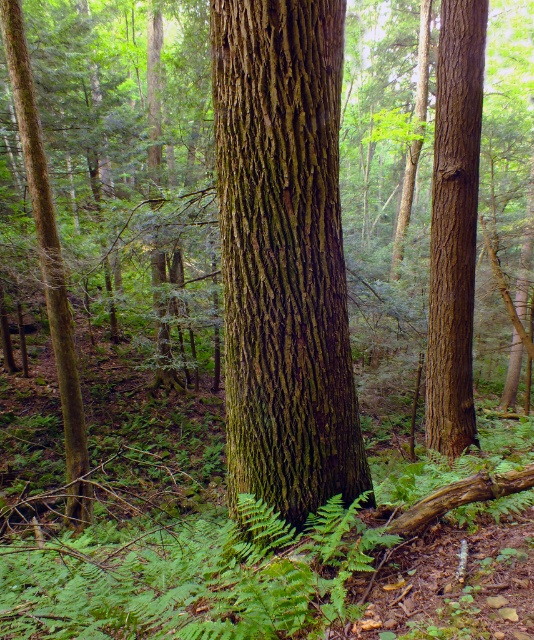
Question: Which object is positioned farthest from the smooth brown tree trunk at right?

Choices:
 (A) green rough bark tree trunk at center
 (B) green rough bark tree at left

Answer: (B)

Question: Which point is closer to the camera taking this photo?

Choices:
 (A) (6, 60)
 (B) (247, 141)
 (C) (449, 333)

Answer: (B)

Question: Is green rough bark tree trunk at center thinner than smooth brown tree trunk at right?

Choices:
 (A) yes
 (B) no

Answer: (B)

Question: Among these points, which one is nearest to the camera?

Choices:
 (A) (437, 129)
 (B) (310, 177)
 (C) (74, 388)

Answer: (B)

Question: Can you confirm if green rough bark tree trunk at center is positioned below smooth brown tree trunk at right?

Choices:
 (A) yes
 (B) no

Answer: (A)

Question: Can you confirm if green rough bark tree trunk at center is bigger than smooth brown tree trunk at right?

Choices:
 (A) yes
 (B) no

Answer: (B)